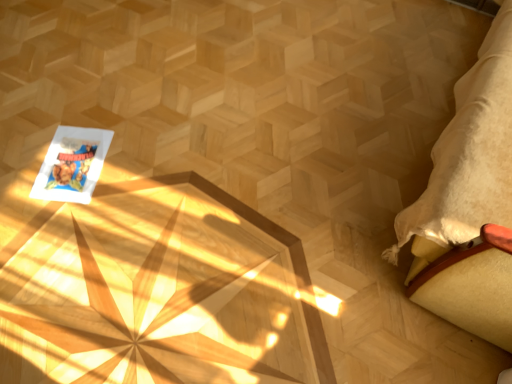
In order to click on beige fabric cushion at right in this screenshot , I will do `click(469, 198)`.

The image size is (512, 384). What do you see at coordinates (469, 198) in the screenshot?
I see `beige fabric cushion at right` at bounding box center [469, 198].

Measure the distance between point (457, 124) and camera.

Point (457, 124) and camera are 1.14 meters apart from each other.

This screenshot has width=512, height=384. Identify the location of beige fabric cushion at right. (469, 198).